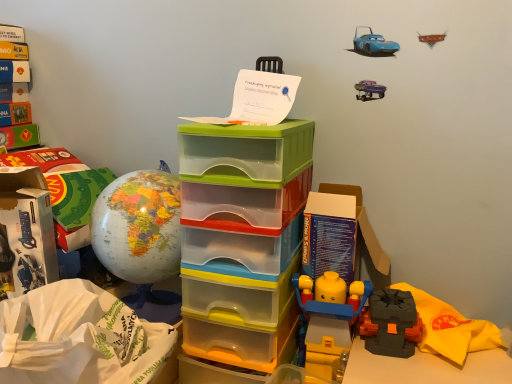
What do you see at coordinates (140, 230) in the screenshot?
I see `matte globe at left` at bounding box center [140, 230].

The height and width of the screenshot is (384, 512). What do you see at coordinates (25, 232) in the screenshot? I see `white cardboard box at left, marked as the second storage box in a right-to-left arrangement` at bounding box center [25, 232].

Measure the distance between matte black lego piece at lower right and camera.

matte black lego piece at lower right and camera are 27.25 inches apart from each other.

I want to click on matte globe at left, so click(140, 230).

Is matte black lego piece at lower right further to camera compared to white paper bag at lower left?

Yes, matte black lego piece at lower right is further from the viewer.

Who is taller, matte black lego piece at lower right or white paper bag at lower left?

white paper bag at lower left is taller.

Considering the sizes of matte black lego piece at lower right and white paper bag at lower left in the image, is matte black lego piece at lower right wider or thinner than white paper bag at lower left?

Considering their sizes, matte black lego piece at lower right looks slimmer than white paper bag at lower left.

Between matte black lego piece at lower right and white paper bag at lower left, which one appears on the left side from the viewer's perspective?

white paper bag at lower left is more to the left.

Can you confirm if matte black lego piece at lower right is shorter than white cardboard box at left, marked as the second storage box in a right-to-left arrangement?

Yes, matte black lego piece at lower right is shorter than white cardboard box at left, marked as the second storage box in a right-to-left arrangement.

Considering their positions, is matte black lego piece at lower right located in front of or behind white cardboard box at left, which is the first storage box from left to right?

In the image, matte black lego piece at lower right appears in front of white cardboard box at left, which is the first storage box from left to right.

From a real-world perspective, is matte black lego piece at lower right physically located above or below white cardboard box at left, marked as the second storage box in a right-to-left arrangement?

In terms of real-world spatial position, matte black lego piece at lower right is below white cardboard box at left, marked as the second storage box in a right-to-left arrangement.

Does matte black lego piece at lower right turn towards white cardboard box at left, which is the first storage box from left to right?

No.

Which is more to the left, matte globe at left or white paper bag at lower left?

white paper bag at lower left is more to the left.

Considering the sizes of objects matte globe at left and white paper bag at lower left in the image provided, who is taller, matte globe at left or white paper bag at lower left?

matte globe at left.

Measure the distance from white cardboard box at left, which is the first storage box from left to right, to matte globe at left.

The distance of white cardboard box at left, which is the first storage box from left to right, from matte globe at left is 5.90 inches.

Could you tell me if white cardboard box at left, which is the first storage box from left to right, is turned towards matte globe at left?

No, white cardboard box at left, which is the first storage box from left to right, is not aimed at matte globe at left.

From a real-world perspective, between white cardboard box at left, which is the first storage box from left to right, and matte globe at left, who is vertically higher?

matte globe at left.

From a real-world perspective, starting from the matte globe at left, which storage box is the 1st one below it? Please provide its 2D coordinates.

[(25, 232)]

From the image's perspective, is white paper bag at lower left positioned above or below white cardboard box at left, marked as the second storage box in a right-to-left arrangement?

white paper bag at lower left is situated lower than white cardboard box at left, marked as the second storage box in a right-to-left arrangement, in the image.

Is white paper bag at lower left to the right of white cardboard box at left, marked as the second storage box in a right-to-left arrangement, from the viewer's perspective?

Yes.

Could you tell me if white paper bag at lower left is facing white cardboard box at left, which is the first storage box from left to right?

No, white paper bag at lower left is not aimed at white cardboard box at left, which is the first storage box from left to right.

Which of these two, white paper bag at lower left or white cardboard box at left, which is the first storage box from left to right, is thinner?

Thinner between the two is white cardboard box at left, which is the first storage box from left to right.

Is translucent plastic storage box at center, arranged as the 1th storage box when viewed from the right, shorter than matte globe at left?

Incorrect, the height of translucent plastic storage box at center, arranged as the 1th storage box when viewed from the right, does not fall short of that of matte globe at left.

Locate an element on the screen. storage box that appears in front of the matte globe at left is located at coordinates (242, 237).

From the image's perspective, which is below, translucent plastic storage box at center, arranged as the 1th storage box when viewed from the right, or matte globe at left?

translucent plastic storage box at center, arranged as the 1th storage box when viewed from the right, appears lower in the image.

Could you measure the distance between translucent plastic storage box at center, positioned as the 2th storage box in left-to-right order, and matte globe at left?

translucent plastic storage box at center, positioned as the 2th storage box in left-to-right order, is 4.88 inches away from matte globe at left.

Is translucent plastic storage box at center, arranged as the 1th storage box when viewed from the right, shorter than matte black lego piece at lower right?

In fact, translucent plastic storage box at center, arranged as the 1th storage box when viewed from the right, may be taller than matte black lego piece at lower right.

Considering the points (285, 333) and (447, 320), which point is in front, point (285, 333) or point (447, 320)?

Positioned in front is point (285, 333).

The height and width of the screenshot is (384, 512). I want to click on storage box lying in front of the matte black lego piece at lower right, so click(x=242, y=237).

Identify the location of material that appears behind the white paper bag at lower left. Image resolution: width=512 pixels, height=384 pixels. (450, 328).

Image resolution: width=512 pixels, height=384 pixels. Find the location of `material on the right of white cardboard box at left, marked as the second storage box in a right-to-left arrangement`. material on the right of white cardboard box at left, marked as the second storage box in a right-to-left arrangement is located at coordinates (450, 328).

Which object lies nearer to the anchor point matte black lego piece at lower right, white cardboard box at left, marked as the second storage box in a right-to-left arrangement, or white paper bag at lower left?

Among the two, white paper bag at lower left is located nearer to matte black lego piece at lower right.

Which object lies further to the anchor point translucent plastic storage box at center, positioned as the 2th storage box in left-to-right order, matte globe at left or white paper bag at lower left?

white paper bag at lower left lies further to translucent plastic storage box at center, positioned as the 2th storage box in left-to-right order, than the other object.

When comparing their distances from translucent plastic storage box at center, positioned as the 2th storage box in left-to-right order, does matte globe at left or matte black lego piece at lower right seem closer?

matte globe at left lies closer to translucent plastic storage box at center, positioned as the 2th storage box in left-to-right order, than the other object.

Estimate the real-world distances between objects in this image. Which object is further from translucent plastic storage box at center, arranged as the 1th storage box when viewed from the right, matte black lego piece at lower right or matte globe at left?

matte black lego piece at lower right is further to translucent plastic storage box at center, arranged as the 1th storage box when viewed from the right.

From the image, which object appears to be farther from white cardboard box at left, which is the first storage box from left to right, matte black lego piece at lower right or matte globe at left?

matte black lego piece at lower right is positioned further to the anchor white cardboard box at left, which is the first storage box from left to right.

Based on their spatial positions, is white paper bag at lower left or white cardboard box at left, which is the first storage box from left to right, closer to matte black lego piece at lower right?

Based on the image, white paper bag at lower left appears to be nearer to matte black lego piece at lower right.

From the image, which object appears to be farther from white cardboard box at left, which is the first storage box from left to right, matte globe at left or matte black lego piece at lower right?

matte black lego piece at lower right is further to white cardboard box at left, which is the first storage box from left to right.

Which object lies further to the anchor point white paper bag at lower left, translucent plastic storage box at center, arranged as the 1th storage box when viewed from the right, or matte globe at left?

translucent plastic storage box at center, arranged as the 1th storage box when viewed from the right, is further to white paper bag at lower left.

Where is `toy situated between white cardboard box at left, marked as the second storage box in a right-to-left arrangement, and matte black lego piece at lower right from left to right`? This screenshot has width=512, height=384. toy situated between white cardboard box at left, marked as the second storage box in a right-to-left arrangement, and matte black lego piece at lower right from left to right is located at coordinates (140, 230).

Find the location of `toy situated between white paper bag at lower left and matte black lego piece at lower right from left to right`. toy situated between white paper bag at lower left and matte black lego piece at lower right from left to right is located at coordinates (140, 230).

Find the location of a particular element. toy positioned between white paper bag at lower left and white cardboard box at left, marked as the second storage box in a right-to-left arrangement, from near to far is located at coordinates (140, 230).

Locate an element on the screen. storage box between white paper bag at lower left and matte black lego piece at lower right is located at coordinates (242, 237).